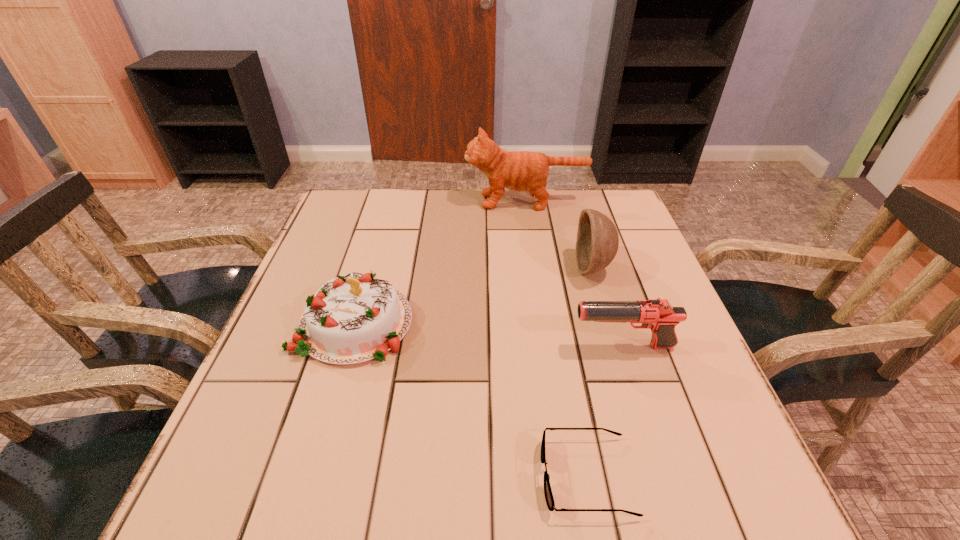
Find the location of a particular element. vacant space located on the back of the fourth shortest object is located at coordinates point(572,198).

Find the location of a particular element. vacant space situated on the right of the leftmost object is located at coordinates (532, 323).

What are the coordinates of `vacant point located at the aiming end of the gun` in the screenshot? It's located at (518, 347).

Identify the location of free point located 0.090m at the aiming end of the gun. The height and width of the screenshot is (540, 960). (528, 347).

Locate an element on the screen. The width and height of the screenshot is (960, 540). vacant area situated at the aiming end of the gun is located at coordinates (x=397, y=347).

Locate an element on the screen. This screenshot has height=540, width=960. free space located 0.300m on the front-facing side of the shortest object is located at coordinates (354, 476).

Where is `free space located 0.400m on the front-facing side of the shortest object`? This screenshot has height=540, width=960. free space located 0.400m on the front-facing side of the shortest object is located at coordinates (292, 476).

This screenshot has width=960, height=540. I want to click on blank area located on the front-facing side of the shortest object, so click(379, 476).

This screenshot has height=540, width=960. Identify the location of object situated at the far edge. (520, 171).

Locate an element on the screen. This screenshot has height=540, width=960. object that is positioned at the near edge is located at coordinates (549, 498).